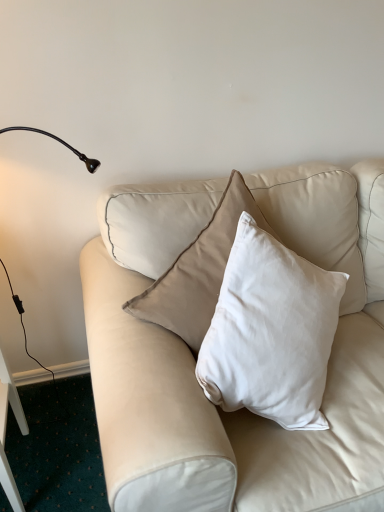
What do you see at coordinates (194, 360) in the screenshot?
I see `suede beige couch at center` at bounding box center [194, 360].

I want to click on suede beige couch at center, so click(x=194, y=360).

Image resolution: width=384 pixels, height=512 pixels. Identify the location of suede beige couch at center. (194, 360).